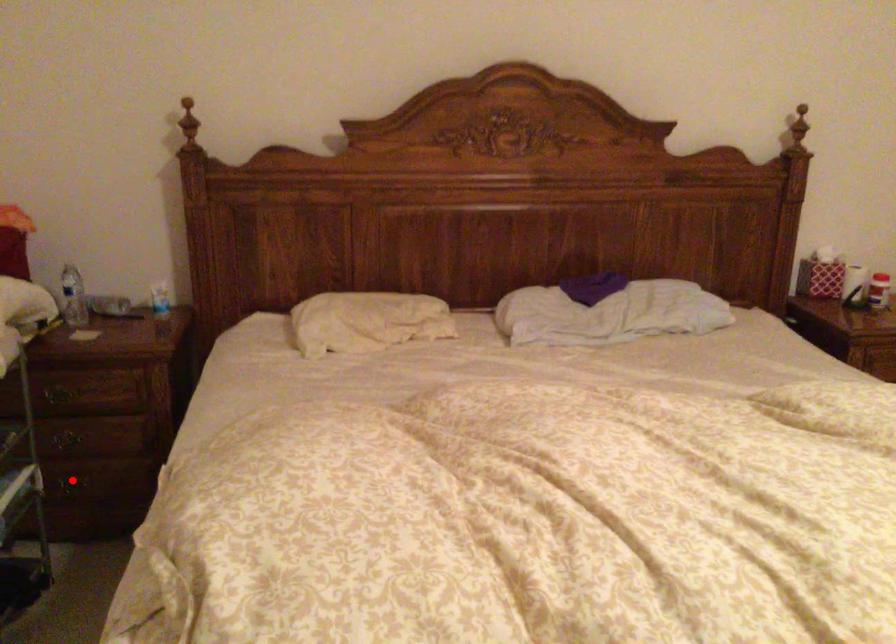
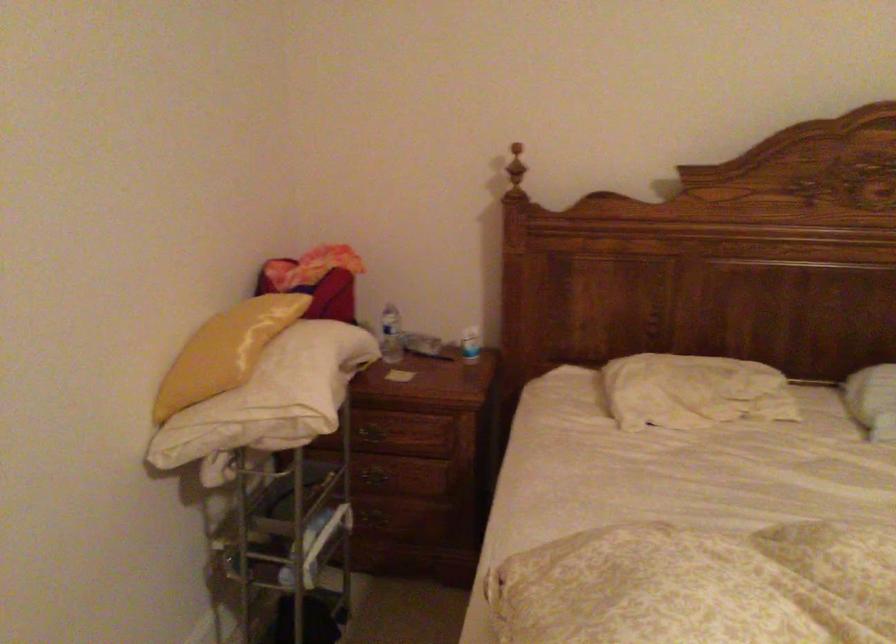
The point at the highlighted location is marked in the first image. Where is the corresponding point in the second image?

(381, 516)